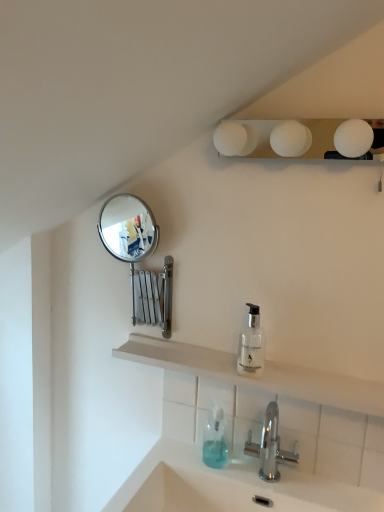
Question: Should I look upward or downward to see chrome metallic faucet at lower center?

Choices:
 (A) down
 (B) up

Answer: (A)

Question: Does transparent glass soap dispenser at center, the 2th soap dispenser in the bottom-to-top sequence, have a lesser height compared to white matte light fixture at upper center?

Choices:
 (A) yes
 (B) no

Answer: (B)

Question: Can you confirm if transparent glass soap dispenser at center, the first soap dispenser viewed from the right, is positioned to the right of white matte light fixture at upper center?

Choices:
 (A) yes
 (B) no

Answer: (B)

Question: Can you confirm if transparent glass soap dispenser at center, positioned as the first soap dispenser in top-to-bottom order, is taller than white matte light fixture at upper center?

Choices:
 (A) no
 (B) yes

Answer: (B)

Question: Is transparent glass soap dispenser at center, the first soap dispenser viewed from the right, facing away from white matte light fixture at upper center?

Choices:
 (A) yes
 (B) no

Answer: (B)

Question: Considering the relative sizes of transparent glass soap dispenser at center, the 2th soap dispenser in the bottom-to-top sequence, and white matte light fixture at upper center in the image provided, is transparent glass soap dispenser at center, the 2th soap dispenser in the bottom-to-top sequence, wider than white matte light fixture at upper center?

Choices:
 (A) yes
 (B) no

Answer: (B)

Question: From a real-world perspective, is transparent glass soap dispenser at center, the 2th soap dispenser in the bottom-to-top sequence, on top of white matte light fixture at upper center?

Choices:
 (A) no
 (B) yes

Answer: (A)

Question: Does chrome metallic faucet at lower center appear on the left side of white matte shelf at center?

Choices:
 (A) yes
 (B) no

Answer: (B)

Question: From the image's perspective, is chrome metallic faucet at lower center under white matte shelf at center?

Choices:
 (A) no
 (B) yes

Answer: (B)

Question: Can you confirm if chrome metallic faucet at lower center is wider than white matte shelf at center?

Choices:
 (A) no
 (B) yes

Answer: (B)

Question: Is white matte shelf at center at the back of chrome metallic faucet at lower center?

Choices:
 (A) no
 (B) yes

Answer: (A)

Question: From a real-world perspective, is chrome metallic faucet at lower center over white matte shelf at center?

Choices:
 (A) yes
 (B) no

Answer: (B)

Question: Could you tell me if chrome metallic faucet at lower center is turned towards white matte shelf at center?

Choices:
 (A) no
 (B) yes

Answer: (A)

Question: Considering the relative sizes of white matte light fixture at upper center and white matte shelf at center in the image provided, is white matte light fixture at upper center thinner than white matte shelf at center?

Choices:
 (A) no
 (B) yes

Answer: (A)